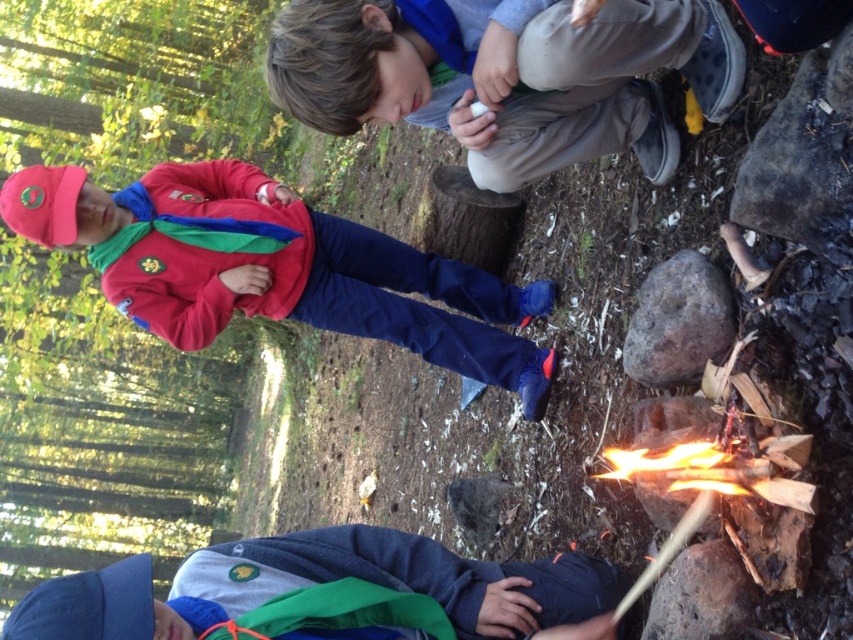
Which of these two, red fleece jacket at left or dark blue fleece jacket at lower center, stands taller?

With more height is red fleece jacket at left.

Does red fleece jacket at left appear on the left side of dark blue fleece jacket at lower center?

Yes, red fleece jacket at left is to the left of dark blue fleece jacket at lower center.

Who is more forward, [451,296] or [320,634]?

Point [320,634] is in front.

At what (x,y) coordinates should I click in order to perform the action: click on red fleece jacket at left. Please return your answer as a coordinate pair (x, y). Looking at the image, I should click on (276, 268).

Who is taller, green leafy tree at upper left or red fleece jacket at left?

green leafy tree at upper left

Is green leafy tree at upper left behind red fleece jacket at left?

Yes.

Is point (160, 451) in front of point (416, 284)?

No.

Locate an element on the screen. The image size is (853, 640). green leafy tree at upper left is located at coordinates (102, 428).

Which of these two, green leafy tree at upper left or gray cotton pants at upper right, stands taller?

With more height is green leafy tree at upper left.

The image size is (853, 640). I want to click on green leafy tree at upper left, so click(102, 428).

At what (x,y) coordinates should I click in order to perform the action: click on green leafy tree at upper left. Please return your answer as a coordinate pair (x, y). Looking at the image, I should click on (102, 428).